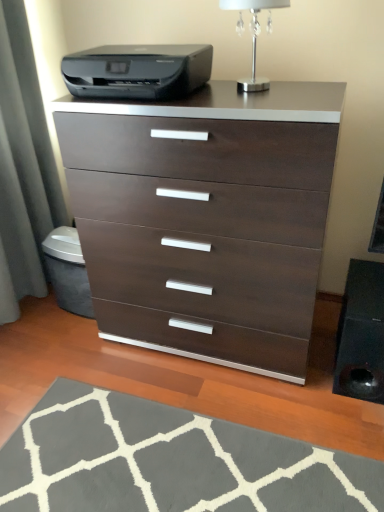
Question: Based on their sizes in the image, would you say silver metallic table lamp at upper center is bigger or smaller than black plastic printer at upper center?

Choices:
 (A) big
 (B) small

Answer: (B)

Question: From a real-world perspective, relative to black plastic printer at upper center, is silver metallic table lamp at upper center vertically above or below?

Choices:
 (A) below
 (B) above

Answer: (B)

Question: Which object is the farthest from the gray soft rug at lower center?

Choices:
 (A) dark wood/finish chest of drawers at center
 (B) black plastic printer at upper center
 (C) silver metallic table lamp at upper center

Answer: (C)

Question: Which of these objects is positioned farthest from the dark wood/finish chest of drawers at center?

Choices:
 (A) silver metallic table lamp at upper center
 (B) gray soft rug at lower center
 (C) black plastic printer at upper center

Answer: (A)